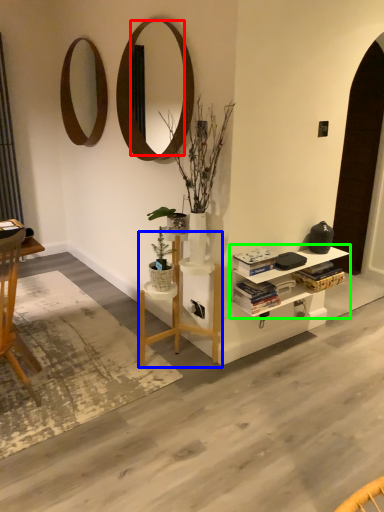
Question: Estimate the real-world distances between objects in this image. Which object is farther from mirror (highlighted by a red box), table (highlighted by a blue box) or shelf (highlighted by a green box)?

Choices:
 (A) table
 (B) shelf

Answer: (B)